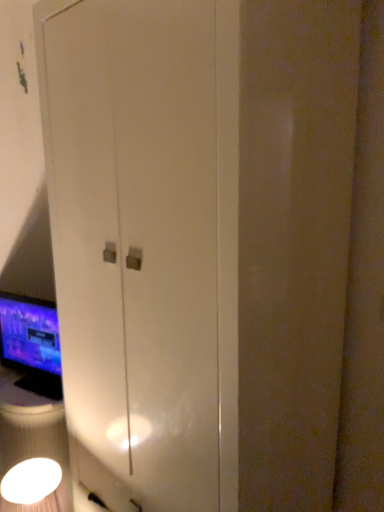
Measure the distance between white glossy light fixture at lower left and camera.

A distance of 5.21 feet exists between white glossy light fixture at lower left and camera.

Describe the element at coordinates (33, 487) in the screenshot. This screenshot has height=512, width=384. I see `white glossy light fixture at lower left` at that location.

Where is `white glossy light fixture at lower left`? The image size is (384, 512). white glossy light fixture at lower left is located at coordinates coord(33,487).

Identify the location of matte black monitor at left. The image size is (384, 512). (31, 344).

What do you see at coordinates (31, 344) in the screenshot? I see `matte black monitor at left` at bounding box center [31, 344].

What is the approximate width of matte black monitor at left?

matte black monitor at left is 2.30 inches wide.

This screenshot has height=512, width=384. In order to click on white glossy light fixture at lower left in this screenshot , I will do `click(33, 487)`.

Does white glossy light fixture at lower left appear on the right side of matte black monitor at left?

Yes.

Which object is closer to the camera, white glossy light fixture at lower left or matte black monitor at left?

white glossy light fixture at lower left.

Is point (42, 478) positioned behind point (39, 376)?

No, it is not.

From the image's perspective, who appears lower, white glossy light fixture at lower left or matte black monitor at left?

From the image's view, white glossy light fixture at lower left is below.

From a real-world perspective, is white glossy light fixture at lower left below matte black monitor at left?

Correct, in the physical world, white glossy light fixture at lower left is lower than matte black monitor at left.

Can you confirm if white glossy light fixture at lower left is thinner than matte black monitor at left?

Incorrect, the width of white glossy light fixture at lower left is not less than that of matte black monitor at left.

Considering the sizes of white glossy light fixture at lower left and matte black monitor at left in the image, is white glossy light fixture at lower left taller or shorter than matte black monitor at left?

In the image, white glossy light fixture at lower left appears to be shorter than matte black monitor at left.

Considering the sizes of objects white glossy light fixture at lower left and matte black monitor at left in the image provided, who is bigger, white glossy light fixture at lower left or matte black monitor at left?

With larger size is white glossy light fixture at lower left.

Is white glossy light fixture at lower left surrounding matte black monitor at left?

No.

Is white glossy light fixture at lower left next to matte black monitor at left and touching it?

No.

Does white glossy light fixture at lower left turn towards matte black monitor at left?

No, white glossy light fixture at lower left is not facing towards matte black monitor at left.

Locate an element on the screen. The width and height of the screenshot is (384, 512). computer monitor above the white glossy light fixture at lower left (from the image's perspective) is located at coordinates (31, 344).

Considering the positions of objects matte black monitor at left and white glossy light fixture at lower left in the image provided, who is more to the left, matte black monitor at left or white glossy light fixture at lower left?

Positioned to the left is matte black monitor at left.

Considering the positions of objects matte black monitor at left and white glossy light fixture at lower left in the image provided, who is behind, matte black monitor at left or white glossy light fixture at lower left?

matte black monitor at left is behind.

Considering the points (52, 371) and (24, 475), which point is in front, point (52, 371) or point (24, 475)?

Point (24, 475)

From the image's perspective, between matte black monitor at left and white glossy light fixture at lower left, who is located below?

white glossy light fixture at lower left appears lower in the image.

From a real-world perspective, is matte black monitor at left located beneath white glossy light fixture at lower left?

No, from a real-world perspective, matte black monitor at left is not beneath white glossy light fixture at lower left.

Is matte black monitor at left wider than white glossy light fixture at lower left?

No.

In terms of height, does matte black monitor at left look taller or shorter compared to white glossy light fixture at lower left?

Clearly, matte black monitor at left is taller compared to white glossy light fixture at lower left.

Considering the relative sizes of matte black monitor at left and white glossy light fixture at lower left in the image provided, is matte black monitor at left bigger than white glossy light fixture at lower left?

Incorrect, matte black monitor at left is not larger than white glossy light fixture at lower left.

Do you think matte black monitor at left is within white glossy light fixture at lower left, or outside of it?

matte black monitor at left is not inside white glossy light fixture at lower left, it's outside.

Would you consider matte black monitor at left to be distant from white glossy light fixture at lower left?

No, matte black monitor at left is in close proximity to white glossy light fixture at lower left.

Does matte black monitor at left turn towards white glossy light fixture at lower left?

No, matte black monitor at left does not turn towards white glossy light fixture at lower left.

Identify the location of light fixture on the right side of matte black monitor at left. This screenshot has width=384, height=512. (33, 487).

Find the location of a particular element. This screenshot has width=384, height=512. light fixture located on the right of matte black monitor at left is located at coordinates (33, 487).

Locate an element on the screen. This screenshot has height=512, width=384. computer monitor above the white glossy light fixture at lower left (from a real-world perspective) is located at coordinates (31, 344).